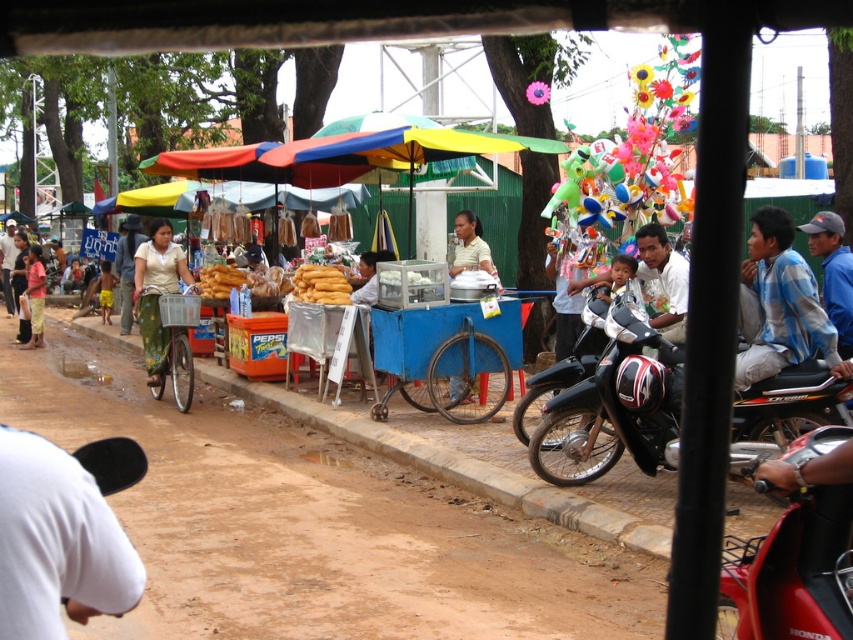
From the picture: You are a customer standing at the entrance of the market. You see the red glossy motorcycle at lower right and the blue plaid shirt at right. Which object is positioned to the left of the other?

The red glossy motorcycle at lower right is to the left of the blue plaid shirt at right.

You are standing at the center of the street and want to reach the red glossy motorcycle at lower right. According to the coordinates given, in which direction should you walk from your current position to reach it?

The red glossy motorcycle at lower right is located at coordinates point (795, 548). Since you are at the center of the street, you should walk towards the lower right direction to reach it.

You are a customer at the food stall and want to find the red glossy motorcycle at lower right. Which direction should you look relative to the blue plaid shirt at right?

The red glossy motorcycle at lower right is located below the blue plaid shirt at right, so you should look downward from the blue plaid shirt at right to find it.